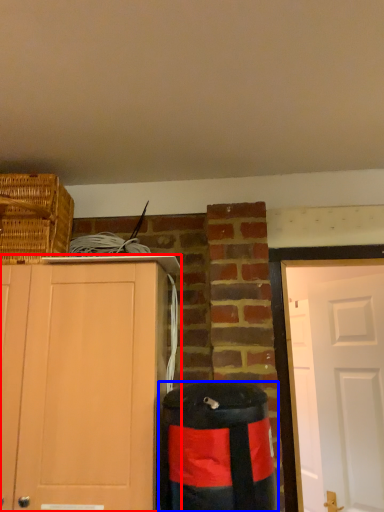
Question: Among these objects, which one is nearest to the camera, cabinetry (highlighted by a red box) or waste container (highlighted by a blue box)?

Choices:
 (A) cabinetry
 (B) waste container

Answer: (B)